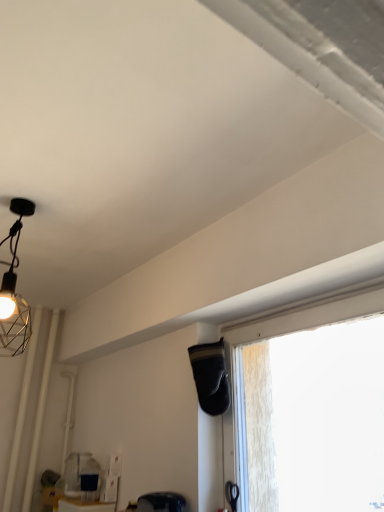
Where is `matte black swivel chair at lower center`? This screenshot has width=384, height=512. matte black swivel chair at lower center is located at coordinates coord(161,502).

Describe the element at coordinates (161, 502) in the screenshot. I see `matte black swivel chair at lower center` at that location.

Find the location of a particular element. transparent glass window at center is located at coordinates (309, 315).

Describe the element at coordinates (309, 315) in the screenshot. This screenshot has height=512, width=384. I see `transparent glass window at center` at that location.

Measure the distance between point (234, 403) and camera.

Point (234, 403) and camera are 5.25 feet apart from each other.

In order to face transparent glass window at center, should I rotate leftwards or rightwards?

A 13.535 degree turn to the right will do.

This screenshot has width=384, height=512. Find the location of `matte black swivel chair at lower center`. matte black swivel chair at lower center is located at coordinates (161, 502).

Would you say transparent glass window at center is to the left or to the right of matte black swivel chair at lower center in the picture?

Based on their positions, transparent glass window at center is located to the right of matte black swivel chair at lower center.

Is transparent glass window at center behind matte black swivel chair at lower center?

No, transparent glass window at center is in front of matte black swivel chair at lower center.

Considering the points (239, 424) and (168, 501), which point is behind, point (239, 424) or point (168, 501)?

Point (168, 501)

From the image's perspective, who appears lower, transparent glass window at center or matte black swivel chair at lower center?

matte black swivel chair at lower center is shown below in the image.

From a real-world perspective, which is physically below, transparent glass window at center or matte black swivel chair at lower center?

matte black swivel chair at lower center is physically lower.

Is transparent glass window at center wider than matte black swivel chair at lower center?

No, transparent glass window at center is not wider than matte black swivel chair at lower center.

Considering the relative sizes of transparent glass window at center and matte black swivel chair at lower center in the image provided, is transparent glass window at center shorter than matte black swivel chair at lower center?

No.

In the scene shown: Considering the relative sizes of transparent glass window at center and matte black swivel chair at lower center in the image provided, is transparent glass window at center smaller than matte black swivel chair at lower center?

Incorrect, transparent glass window at center is not smaller in size than matte black swivel chair at lower center.

Is transparent glass window at center located outside matte black swivel chair at lower center?

transparent glass window at center is positioned outside matte black swivel chair at lower center.

Is transparent glass window at center not close to matte black swivel chair at lower center?

That's not correct — transparent glass window at center is a little close to matte black swivel chair at lower center.

Could you tell me if transparent glass window at center is turned towards matte black swivel chair at lower center?

No, transparent glass window at center is not aimed at matte black swivel chair at lower center.

How different are the orientations of transparent glass window at center and matte black swivel chair at lower center in degrees?

transparent glass window at center and matte black swivel chair at lower center are facing 97.8 degrees away from each other.

At what (x,y) coordinates should I click in order to perform the action: click on swivel chair on the left side of transparent glass window at center. Please return your answer as a coordinate pair (x, y). The image size is (384, 512). Looking at the image, I should click on click(x=161, y=502).

Which object is positioned more to the left, matte black swivel chair at lower center or transparent glass window at center?

matte black swivel chair at lower center.

Is matte black swivel chair at lower center closer to camera compared to transparent glass window at center?

That is False.

Is point (138, 504) positioned after point (322, 302)?

Yes, point (138, 504) is behind point (322, 302).

From the image's perspective, which one is positioned lower, matte black swivel chair at lower center or transparent glass window at center?

matte black swivel chair at lower center, from the image's perspective.

From a real-world perspective, who is located higher, matte black swivel chair at lower center or transparent glass window at center?

transparent glass window at center, from a real-world perspective.

Does matte black swivel chair at lower center have a greater width compared to transparent glass window at center?

Correct, the width of matte black swivel chair at lower center exceeds that of transparent glass window at center.

Considering the sizes of matte black swivel chair at lower center and transparent glass window at center in the image, is matte black swivel chair at lower center taller or shorter than transparent glass window at center?

matte black swivel chair at lower center is shorter than transparent glass window at center.

Considering the sizes of objects matte black swivel chair at lower center and transparent glass window at center in the image provided, who is smaller, matte black swivel chair at lower center or transparent glass window at center?

Smaller between the two is matte black swivel chair at lower center.

Is matte black swivel chair at lower center located outside transparent glass window at center?

Yes, matte black swivel chair at lower center is not within transparent glass window at center.

From the picture: Is matte black swivel chair at lower center placed right next to transparent glass window at center?

matte black swivel chair at lower center and transparent glass window at center are clearly separated.

Based on the photo, is matte black swivel chair at lower center aimed at transparent glass window at center?

No, matte black swivel chair at lower center does not turn towards transparent glass window at center.

I want to click on window lying above the matte black swivel chair at lower center (from the image's perspective), so click(309, 315).

This screenshot has width=384, height=512. What are the coordinates of `window located in front of the matte black swivel chair at lower center` in the screenshot? It's located at (309, 315).

This screenshot has height=512, width=384. Identify the location of window lying above the matte black swivel chair at lower center (from the image's perspective). pyautogui.click(x=309, y=315).